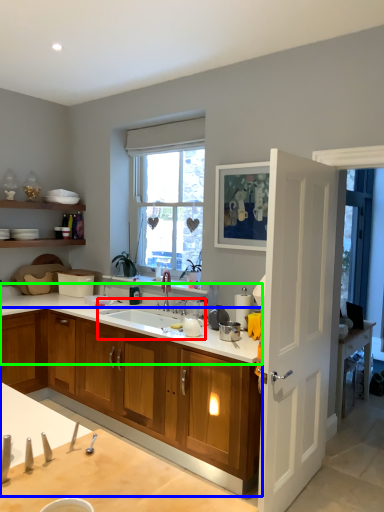
Question: Which is nearer to the sink (highlighted by a red box)? cabinetry (highlighted by a blue box) or countertop (highlighted by a green box).

Choices:
 (A) cabinetry
 (B) countertop

Answer: (B)